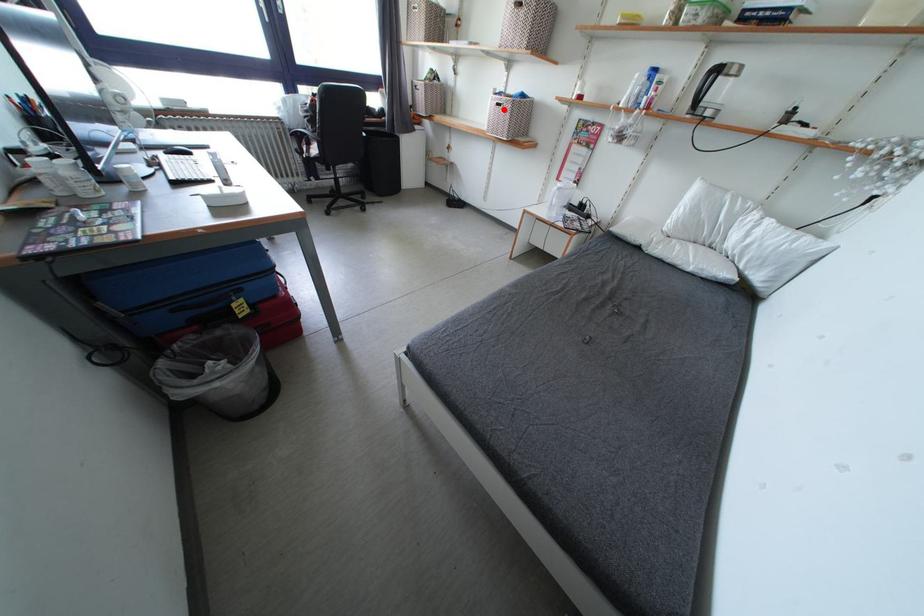
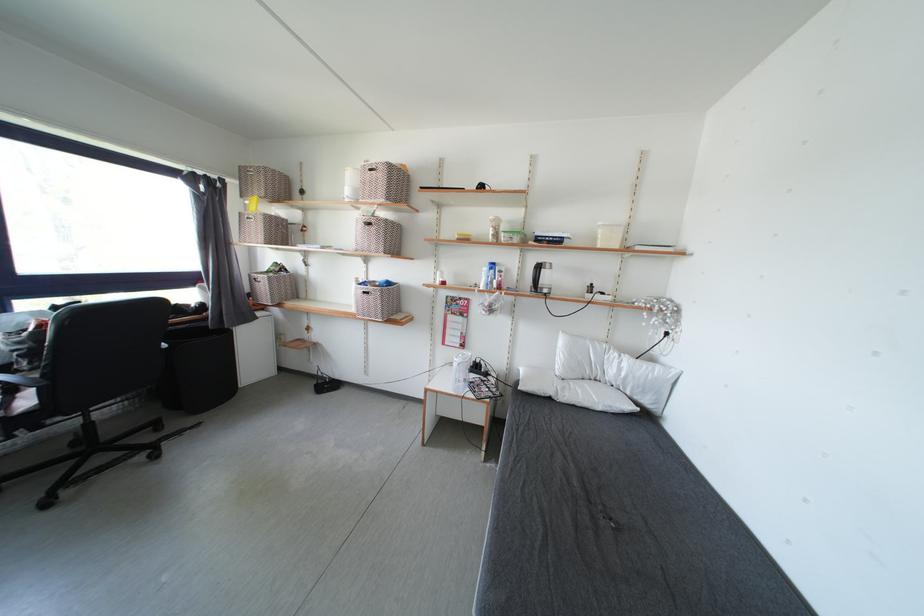
Question: I am providing you with two images of the same scene from different viewpoints. Image1 has a red point marked. In image2, the corresponding 3D location appears at what relative position? Reply with the corresponding letter.

Choices:
 (A) Closer
 (B) Farther

Answer: (B)